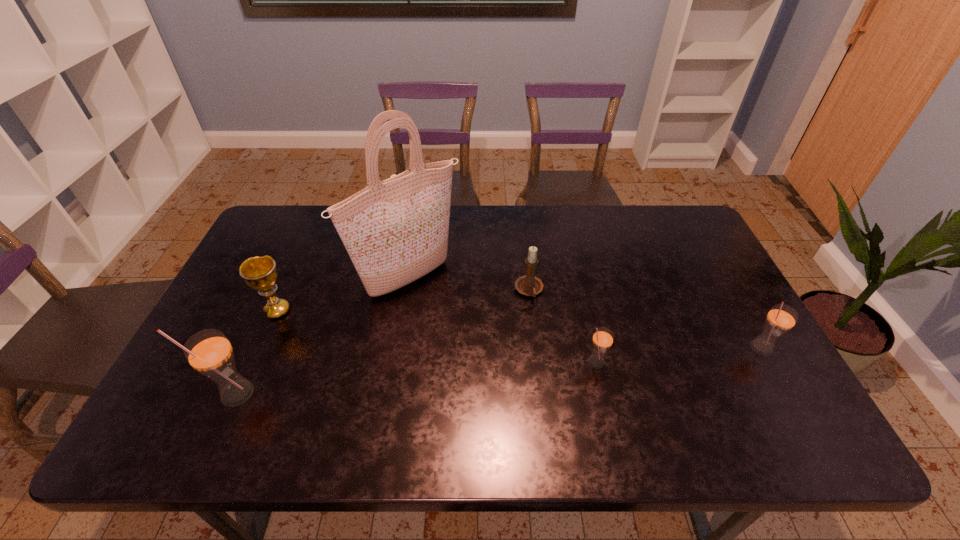
The height and width of the screenshot is (540, 960). I want to click on the tallest straw, so click(209, 352).

At what (x,y) coordinates should I click in order to perform the action: click on the nearest object. Please return your answer as a coordinate pair (x, y). Looking at the image, I should click on (209, 352).

Locate an element on the screen. the shortest straw is located at coordinates (602, 340).

This screenshot has height=540, width=960. What are the coordinates of `the second object from right to left` in the screenshot? It's located at (602, 340).

You are a GUI agent. You are given a task and a screenshot of the screen. Output one action in this format:
    pyautogui.click(x=<x>, y=<y>)
    Task: Click on the rightmost straw
    
    Given the screenshot: What is the action you would take?
    pyautogui.click(x=781, y=318)

I want to click on the second shortest straw, so click(781, 318).

The image size is (960, 540). What are the coordinates of `candle holder` in the screenshot? It's located at (529, 285).

The image size is (960, 540). In order to click on chalice in this screenshot , I will do `click(260, 273)`.

Where is `the fourth object from right to left`? The height and width of the screenshot is (540, 960). the fourth object from right to left is located at coordinates (395, 231).

This screenshot has width=960, height=540. Identify the location of shopping bag. (395, 231).